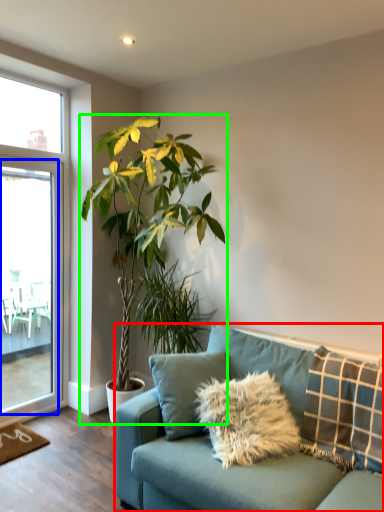
Question: Which object is the closest to the studio couch (highlighted by a red box)? Choose among these: screen door (highlighted by a blue box) or houseplant (highlighted by a green box).

Choices:
 (A) screen door
 (B) houseplant

Answer: (B)